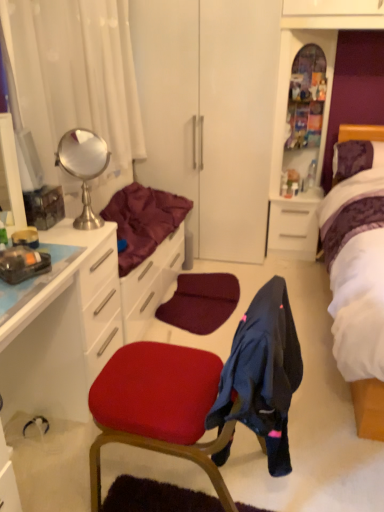
Find the location of a particular element. The height and width of the screenshot is (512, 384). free spot above purple velvet pillow at upper right (from a real-world perspective) is located at coordinates (369, 140).